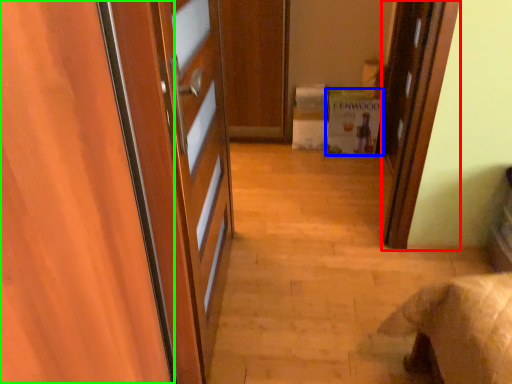
Question: Based on their relative distances, which object is nearer to door (highlighted by a red box)? Choose from cabinetry (highlighted by a blue box) and door (highlighted by a green box).

Choices:
 (A) cabinetry
 (B) door

Answer: (A)